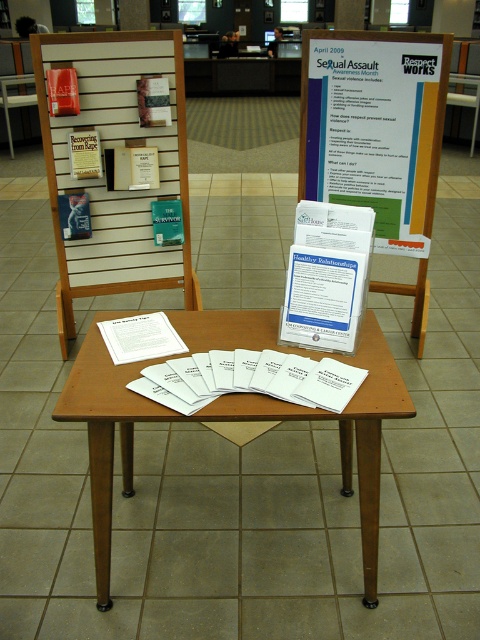
Question: Is white slatted wood at left below brown wooden table at center?

Choices:
 (A) yes
 (B) no

Answer: (B)

Question: Considering the relative positions of white slatted wood at left and wooden chair at left in the image provided, where is white slatted wood at left located with respect to wooden chair at left?

Choices:
 (A) left
 (B) right

Answer: (B)

Question: Which of the following is the closest to the observer?

Choices:
 (A) white paper poster at center
 (B) wooden chair at left
 (C) brown wooden table at center
 (D) white slatted wood at left

Answer: (C)

Question: Which point is farther from the camera taking this photo?

Choices:
 (A) (107, 561)
 (B) (75, 58)

Answer: (B)

Question: Which of these objects is positioned farthest from the wooden chair at left?

Choices:
 (A) white slatted wood at left
 (B) brown wooden table at center
 (C) white paper poster at center

Answer: (B)

Question: Can you confirm if white slatted wood at left is positioned below white paper poster at center?

Choices:
 (A) no
 (B) yes

Answer: (B)